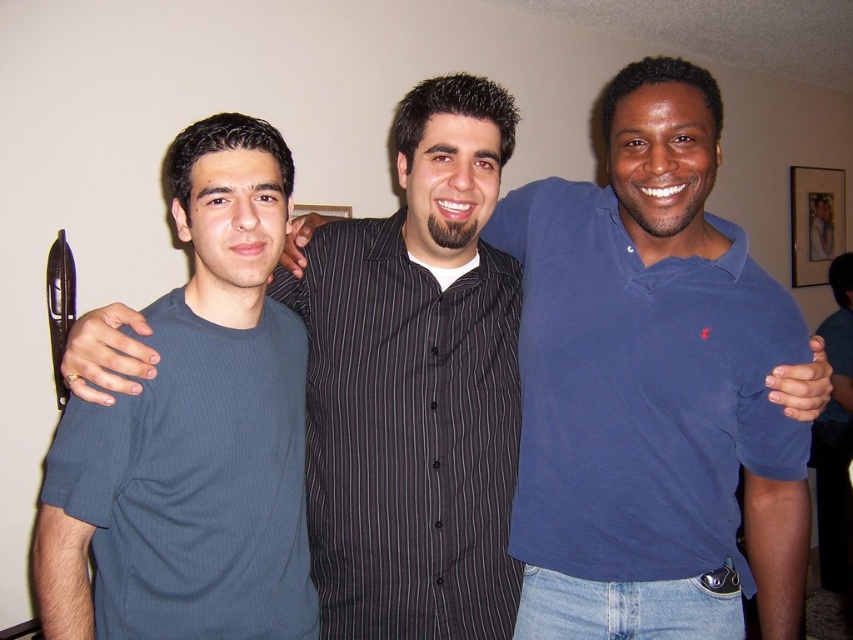
Question: Which object is closer to the camera taking this photo?

Choices:
 (A) black striped shirt at center
 (B) dark blue ribbed t-shirt at left
 (C) wooden framed portrait at upper right

Answer: (B)

Question: Observing the image, what is the correct spatial positioning of dark blue ribbed t-shirt at left in reference to wooden framed portrait at upper right?

Choices:
 (A) left
 (B) right

Answer: (A)

Question: Which point is farther from the camera taking this photo?

Choices:
 (A) (808, 256)
 (B) (65, 586)
 (C) (312, 420)

Answer: (A)

Question: Is black striped shirt at center closer to camera compared to wooden framed portrait at upper right?

Choices:
 (A) yes
 (B) no

Answer: (A)

Question: Which object is the farthest from the dark blue ribbed t-shirt at left?

Choices:
 (A) black striped shirt at center
 (B) wooden framed portrait at upper right

Answer: (B)

Question: Does dark blue ribbed t-shirt at left have a larger size compared to wooden framed portrait at upper right?

Choices:
 (A) yes
 (B) no

Answer: (B)